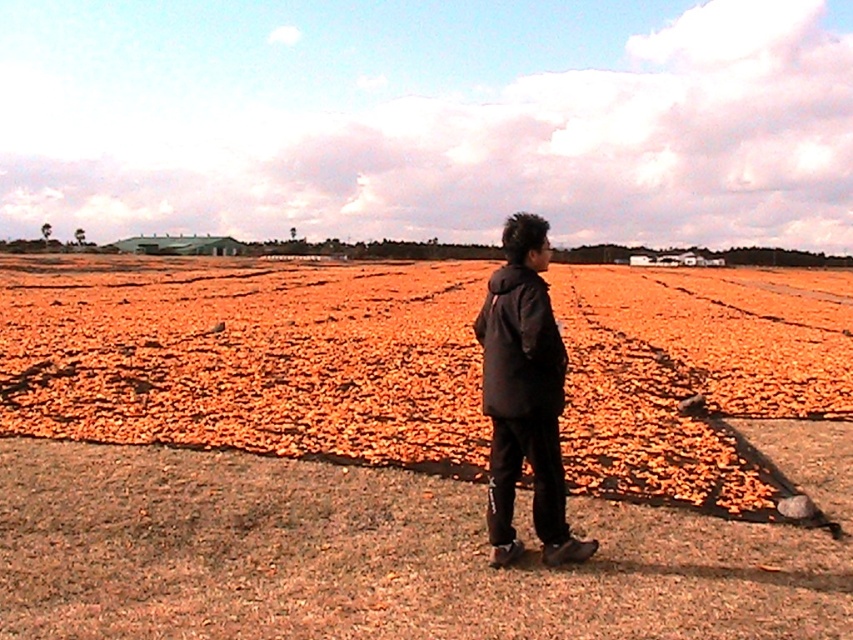
You are a farmer who wants to check the condition of the orange objects in the field. You are currently standing on the brown dirt field at center and wearing the black matte jacket at center. Which item you are in contact with has a larger area?

The brown dirt field at center is larger in size than the black matte jacket at center, so the item you are in contact with that has a larger area is the brown dirt field at center.